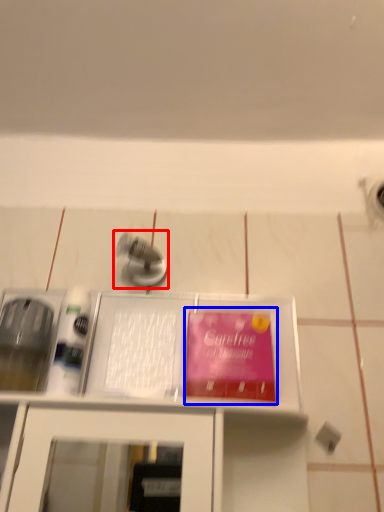
Question: Which point is further to the camera, tap (highlighted by a red box) or paperback book (highlighted by a blue box)?

Choices:
 (A) tap
 (B) paperback book

Answer: (A)